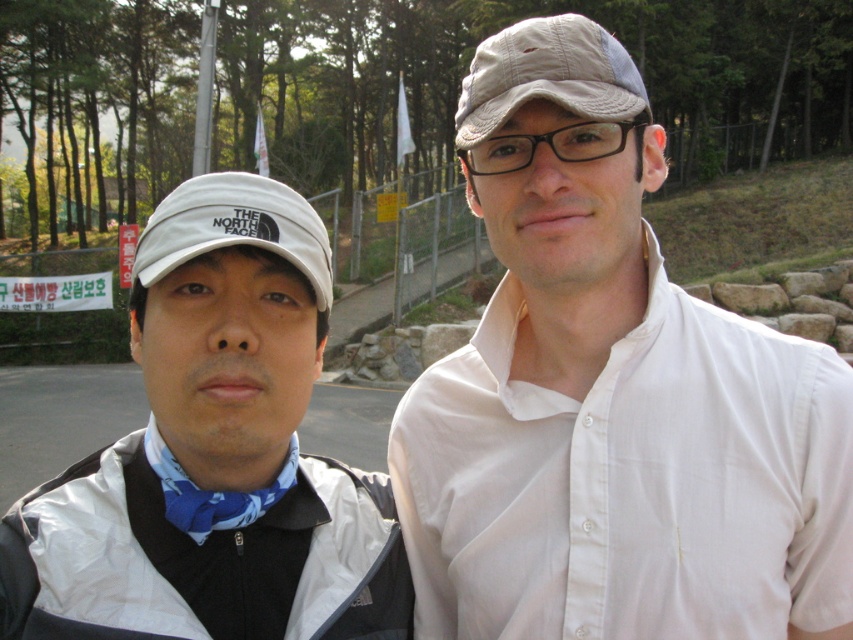
Question: Is white matte shirt at center thinner than white fabric cap at left?

Choices:
 (A) no
 (B) yes

Answer: (A)

Question: Does blue printed fabric shirt at left have a larger size compared to white fabric baseball hat at left?

Choices:
 (A) no
 (B) yes

Answer: (B)

Question: Which object is the farthest from the white fabric baseball hat at left?

Choices:
 (A) blue printed fabric bow tie at center
 (B) blue printed fabric shirt at left
 (C) tan fabric cap at upper center
 (D) white fabric cap at left

Answer: (C)

Question: Based on their relative distances, which object is farther from the white matte shirt at center?

Choices:
 (A) white fabric baseball hat at left
 (B) white fabric cap at left

Answer: (A)

Question: Does white matte shirt at center appear on the right side of tan fabric cap at upper center?

Choices:
 (A) no
 (B) yes

Answer: (B)

Question: Which object is positioned farthest from the white fabric baseball hat at left?

Choices:
 (A) white fabric cap at left
 (B) white matte shirt at center

Answer: (B)